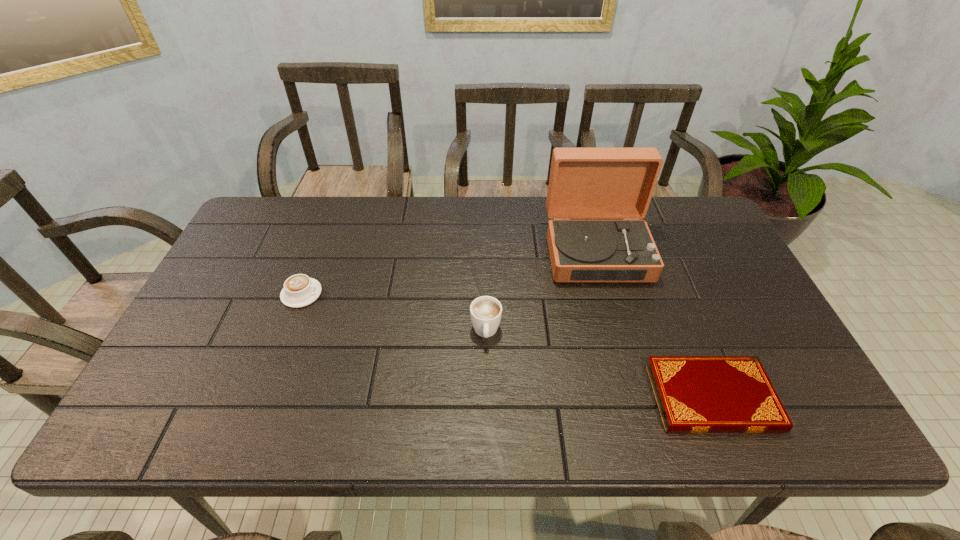
This screenshot has width=960, height=540. I want to click on free space at the far left corner, so click(x=277, y=235).

This screenshot has height=540, width=960. Identify the location of blank space at the far right corner of the desktop. (671, 229).

In the image, there is a desktop. At what (x,y) coordinates should I click in order to perform the action: click on vacant space at the near right corner. Please return your answer as a coordinate pair (x, y). The height and width of the screenshot is (540, 960). Looking at the image, I should click on (800, 436).

Identify the location of free spot between the second tallest object and the third tallest object. The width and height of the screenshot is (960, 540). (394, 313).

Locate an element on the screen. blank region between the third shortest object and the tallest object is located at coordinates (541, 292).

This screenshot has height=540, width=960. I want to click on free space between the left cappuccino and the second nearest object, so click(x=394, y=313).

Locate an element on the screen. empty space that is in between the third farthest object and the hardback book is located at coordinates (598, 364).

The width and height of the screenshot is (960, 540). Identify the location of free spot between the leftmost object and the hardback book. click(507, 346).

Locate an element on the screen. This screenshot has height=540, width=960. free space between the hardback book and the phonograph record is located at coordinates (654, 325).

Locate an element on the screen. This screenshot has width=960, height=540. free space between the tallest object and the left cappuccino is located at coordinates (449, 273).